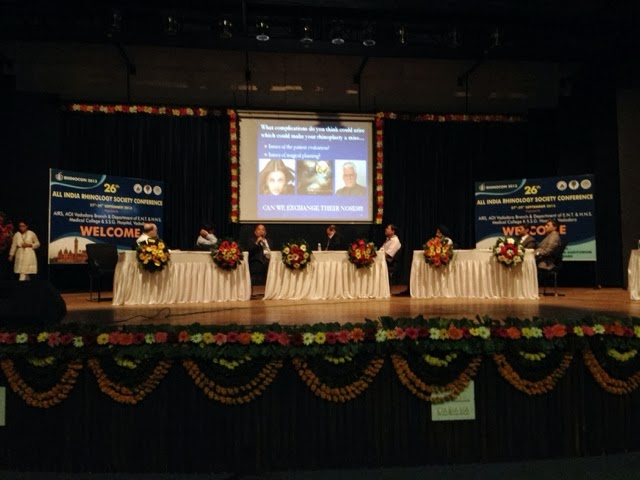
Locate an element on the screen. placard is located at coordinates pyautogui.click(x=546, y=194), pyautogui.click(x=74, y=206).